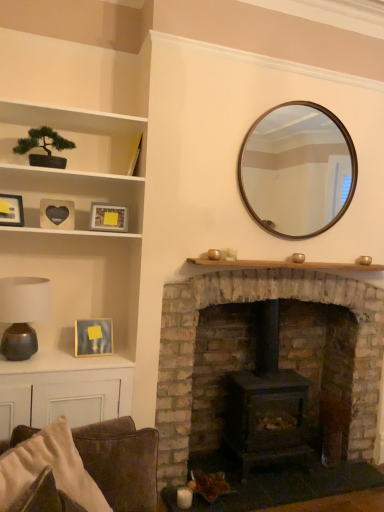
Find the location of a particular element. matte brown table at lower left is located at coordinates (63, 390).

The image size is (384, 512). Describe the element at coordinates (22, 314) in the screenshot. I see `matte brown lamp at left` at that location.

At what (x,y) coordinates should I click in order to perform the action: click on black matte heart at upper left, acting as the first picture frame starting from the top. Please return your answer as a coordinate pair (x, y). This screenshot has height=512, width=384. Looking at the image, I should click on (57, 214).

This screenshot has height=512, width=384. What do you see at coordinates (57, 214) in the screenshot?
I see `black matte heart at upper left, acting as the first picture frame starting from the top` at bounding box center [57, 214].

Describe the element at coordinates (267, 403) in the screenshot. The height and width of the screenshot is (512, 384). I see `dark gray matte wood burning stove at center` at that location.

Locate an element on the screen. dark gray matte wood burning stove at center is located at coordinates (267, 403).

In order to face wooden frame mirror at upper center, should I rotate leftwards or rightwards?

To align with it, rotate right about 14.478°.

The image size is (384, 512). What do you see at coordinates (11, 210) in the screenshot?
I see `wooden picture frame at upper left, marked as the 4th picture frame in a right-to-left arrangement` at bounding box center [11, 210].

Find the location of a particular element. wooden picture frame at upper left, which ranks as the first picture frame in left-to-right order is located at coordinates (11, 210).

Find the location of a particular element. matte brown table at lower left is located at coordinates (63, 390).

In the scene shown: Is wooden at center, the 2th shelf from the top, situated inside matte brown table at lower left or outside?

wooden at center, the 2th shelf from the top, is not enclosed by matte brown table at lower left.

Between point (259, 264) and point (46, 401), which one is positioned in front?

The point (46, 401) is closer.

Is wooden at center, the 2th shelf from the top, turned away from matte brown table at lower left?

No.

From the picture: From a real-world perspective, between wooden at center, which is the 1th shelf in right-to-left order, and matte brown table at lower left, who is vertically higher?

From a 3D spatial view, wooden at center, which is the 1th shelf in right-to-left order, is above.

Image resolution: width=384 pixels, height=512 pixels. What are the coordinates of `pillow below the green matte bonsai tree at upper left, positioned as the first shelf in left-to-right order (from the image's perspective)` in the screenshot? It's located at click(50, 466).

Which object is more forward, white cotton pillow at lower left or green matte bonsai tree at upper left, which ranks as the 1th shelf in top-to-bottom order?

white cotton pillow at lower left is closer to the camera.

Based on their sizes in the image, would you say white cotton pillow at lower left is bigger or smaller than green matte bonsai tree at upper left, the second shelf when ordered from bottom to top?

Clearly, white cotton pillow at lower left is smaller in size than green matte bonsai tree at upper left, the second shelf when ordered from bottom to top.

What's the angular difference between white cotton pillow at lower left and green matte bonsai tree at upper left, the second shelf when ordered from bottom to top,'s facing directions?

55.6 degrees separate the facing orientations of white cotton pillow at lower left and green matte bonsai tree at upper left, the second shelf when ordered from bottom to top.

Is there a large distance between metallic silver picture frame at upper left, the second picture frame when ordered from bottom to top, and wooden at center, placed as the 1th shelf when sorted from bottom to top?

No, metallic silver picture frame at upper left, the second picture frame when ordered from bottom to top, is not far away from wooden at center, placed as the 1th shelf when sorted from bottom to top.

Where is `the 1st picture frame positioned above the wooden at center, which is the 1th shelf in right-to-left order (from a real-world perspective)`? The height and width of the screenshot is (512, 384). the 1st picture frame positioned above the wooden at center, which is the 1th shelf in right-to-left order (from a real-world perspective) is located at coordinates (108, 218).

Is metallic silver picture frame at upper left, which ranks as the 3th picture frame in top-to-bottom order, wider than wooden at center, placed as the 1th shelf when sorted from bottom to top?

No, metallic silver picture frame at upper left, which ranks as the 3th picture frame in top-to-bottom order, is not wider than wooden at center, placed as the 1th shelf when sorted from bottom to top.

Considering the sizes of metallic silver picture frame at upper left, placed as the fourth picture frame when sorted from left to right, and wooden at center, the 2th shelf from the top, in the image, is metallic silver picture frame at upper left, placed as the fourth picture frame when sorted from left to right, taller or shorter than wooden at center, the 2th shelf from the top,?

Clearly, metallic silver picture frame at upper left, placed as the fourth picture frame when sorted from left to right, is taller compared to wooden at center, the 2th shelf from the top.

Considering the sizes of objects wooden picture frame at left, the 1th picture frame when ordered from bottom to top, and wooden picture frame at upper left, marked as the 4th picture frame in a right-to-left arrangement, in the image provided, who is shorter, wooden picture frame at left, the 1th picture frame when ordered from bottom to top, or wooden picture frame at upper left, marked as the 4th picture frame in a right-to-left arrangement,?

wooden picture frame at upper left, marked as the 4th picture frame in a right-to-left arrangement.

Can we say wooden picture frame at left, positioned as the third picture frame in left-to-right order, lies outside wooden picture frame at upper left, which is counted as the second picture frame, starting from the top?

Yes, wooden picture frame at left, positioned as the third picture frame in left-to-right order, is outside of wooden picture frame at upper left, which is counted as the second picture frame, starting from the top.

Which is in front, point (81, 332) or point (13, 200)?

Point (13, 200)

Considering the positions of objects wooden picture frame at left, the second picture frame from the right, and wooden picture frame at upper left, which is counted as the second picture frame, starting from the top, in the image provided, who is more to the left, wooden picture frame at left, the second picture frame from the right, or wooden picture frame at upper left, which is counted as the second picture frame, starting from the top,?

wooden picture frame at upper left, which is counted as the second picture frame, starting from the top.

Which object is wider, matte brown lamp at left or dark gray matte wood burning stove at center?

dark gray matte wood burning stove at center is wider.

How different are the orientations of matte brown lamp at left and dark gray matte wood burning stove at center in degrees?

matte brown lamp at left and dark gray matte wood burning stove at center are facing 0.248 degrees away from each other.

From the image's perspective, would you say matte brown lamp at left is shown under dark gray matte wood burning stove at center?

Actually, matte brown lamp at left appears above dark gray matte wood burning stove at center in the image.

Does matte brown lamp at left have a larger size compared to dark gray matte wood burning stove at center?

No.

Is green matte bonsai tree at upper left, positioned as the first shelf in left-to-right order, located outside matte brown table at lower left?

Yes, green matte bonsai tree at upper left, positioned as the first shelf in left-to-right order, is not within matte brown table at lower left.

Does green matte bonsai tree at upper left, the second shelf positioned from the right, have a lesser height compared to matte brown table at lower left?

No, green matte bonsai tree at upper left, the second shelf positioned from the right, is not shorter than matte brown table at lower left.

Considering their positions, is dark gray matte wood burning stove at center located in front of or behind wooden picture frame at upper left, which is counted as the second picture frame, starting from the top?

dark gray matte wood burning stove at center is positioned farther from the viewer than wooden picture frame at upper left, which is counted as the second picture frame, starting from the top.

Can you confirm if dark gray matte wood burning stove at center is bigger than wooden picture frame at upper left, marked as the 4th picture frame in a right-to-left arrangement?

Yes.

Is dark gray matte wood burning stove at center oriented towards wooden picture frame at upper left, which is counted as the second picture frame, starting from the top?

No, dark gray matte wood burning stove at center does not turn towards wooden picture frame at upper left, which is counted as the second picture frame, starting from the top.

Considering the relative sizes of dark gray matte wood burning stove at center and wooden picture frame at upper left, which ranks as the first picture frame in left-to-right order, in the image provided, is dark gray matte wood burning stove at center taller than wooden picture frame at upper left, which ranks as the first picture frame in left-to-right order,?

Correct, dark gray matte wood burning stove at center is much taller as wooden picture frame at upper left, which ranks as the first picture frame in left-to-right order.

From a real-world perspective, which shelf is the 1st one above the matte brown table at lower left? Please provide its 2D coordinates.

[(287, 265)]

In the image, there is a green matte bonsai tree at upper left, which ranks as the 1th shelf in top-to-bottom order. Identify the location of pillow below it (from a real-world perspective). This screenshot has width=384, height=512. (50, 466).

Looking at the image, which one is located closer to wooden picture frame at left, the second picture frame from the right, black matte heart at upper left, the 3th picture frame in the right-to-left sequence, or matte brown table at lower left?

matte brown table at lower left.

When comparing their distances from wooden picture frame at left, positioned as the third picture frame in left-to-right order, does white cotton pillow at lower left or matte brown lamp at left seem further?

Based on the image, white cotton pillow at lower left appears to be further to wooden picture frame at left, positioned as the third picture frame in left-to-right order.

Based on the photo, which object lies further to the anchor point brick fireplace at center, black matte heart at upper left, acting as the first picture frame starting from the top, or white cotton pillow at lower left?

black matte heart at upper left, acting as the first picture frame starting from the top.

When comparing their distances from wooden picture frame at left, which is the fourth picture frame in top-to-bottom order, does green matte bonsai tree at upper left, the second shelf when ordered from bottom to top, or wooden at center, which is the 1th shelf in right-to-left order, seem closer?

Among the two, wooden at center, which is the 1th shelf in right-to-left order, is located nearer to wooden picture frame at left, which is the fourth picture frame in top-to-bottom order.

Looking at the image, which one is located closer to brick fireplace at center, black matte heart at upper left, the fourth picture frame when ordered from bottom to top, or metallic silver picture frame at upper left, which ranks as the 3th picture frame in top-to-bottom order?

metallic silver picture frame at upper left, which ranks as the 3th picture frame in top-to-bottom order, lies closer to brick fireplace at center than the other object.

Looking at the image, which one is located closer to wooden frame mirror at upper center, white cotton pillow at lower left or matte brown table at lower left?

matte brown table at lower left lies closer to wooden frame mirror at upper center than the other object.

From the image, which object appears to be farther from dark gray matte wood burning stove at center, metallic silver picture frame at upper left, marked as the 1th picture frame in a right-to-left arrangement, or brick fireplace at center?

metallic silver picture frame at upper left, marked as the 1th picture frame in a right-to-left arrangement, lies further to dark gray matte wood burning stove at center than the other object.

Looking at the image, which one is located closer to wooden at center, which is the 1th shelf in right-to-left order, black matte heart at upper left, the 3th picture frame in the right-to-left sequence, or green matte bonsai tree at upper left, the second shelf positioned from the right?

black matte heart at upper left, the 3th picture frame in the right-to-left sequence.

Image resolution: width=384 pixels, height=512 pixels. I want to click on table between white cotton pillow at lower left and black matte heart at upper left, acting as the first picture frame starting from the top, from front to back, so click(63, 390).

The width and height of the screenshot is (384, 512). In order to click on table located between matte brown lamp at left and dark gray matte wood burning stove at center in the left-right direction in this screenshot , I will do `click(63, 390)`.

You are a GUI agent. You are given a task and a screenshot of the screen. Output one action in this format:
    pyautogui.click(x=<x>, y=<y>)
    Task: Click on the shelf between metallic silver picture frame at upper left, marked as the 1th picture frame in a right-to-left arrangement, and wooden frame mirror at upper center from left to right
    
    Given the screenshot: What is the action you would take?
    pyautogui.click(x=287, y=265)

Image resolution: width=384 pixels, height=512 pixels. Find the location of `lamp between white cotton pillow at lower left and matte brown table at lower left along the z-axis`. lamp between white cotton pillow at lower left and matte brown table at lower left along the z-axis is located at coordinates (22, 314).